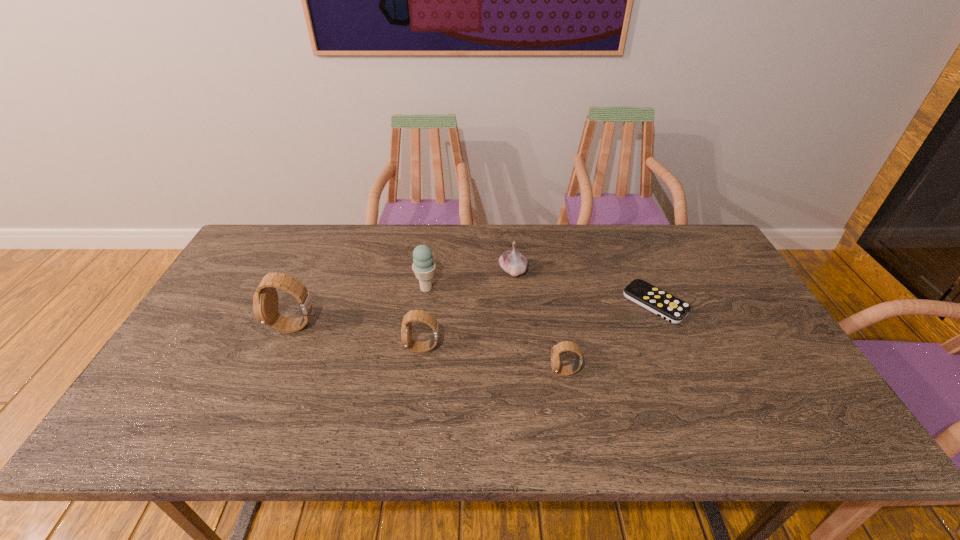
Please point a spot on the right to add another watch. Please provide its 2D coordinates. Your answer should be formatted as a tuple, i.e. [(x, y)], where the tuple contains the x and y coordinates of a point satisfying the conditions above.

[(722, 399)]